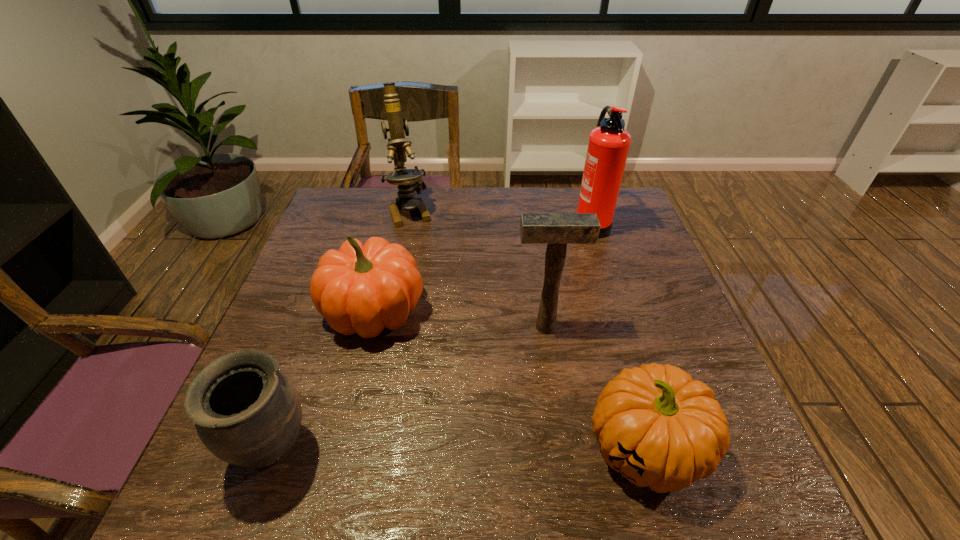
This screenshot has width=960, height=540. I want to click on free space that is in between the microscope and the fire extinguisher, so click(x=500, y=217).

At what (x,y) coordinates should I click in order to perform the action: click on free spot between the right pumpkin and the fire extinguisher. Please return your answer as a coordinate pair (x, y). This screenshot has height=540, width=960. Looking at the image, I should click on (617, 336).

The image size is (960, 540). Identify the location of empty location between the mallet and the nearer pumpkin. (594, 388).

In order to click on vacant space that's between the farther pumpkin and the urn in this screenshot , I will do `click(324, 381)`.

Identify which object is the second closest to the fire extinguisher. Please provide its 2D coordinates. Your answer should be formatted as a tuple, i.e. [(x, y)], where the tuple contains the x and y coordinates of a point satisfying the conditions above.

[(409, 182)]

Identify the location of object identified as the fifth closest to the urn. Image resolution: width=960 pixels, height=540 pixels. (608, 146).